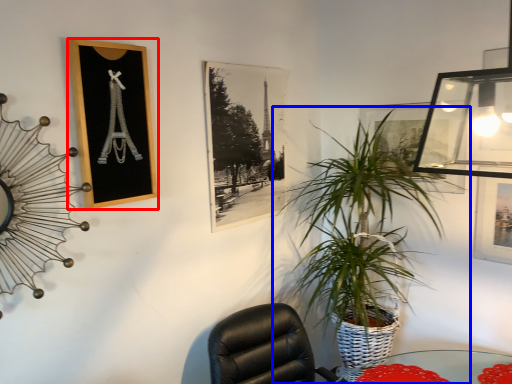
Question: Which object appears farthest to the camera in this image, picture frame (highlighted by a red box) or houseplant (highlighted by a blue box)?

Choices:
 (A) picture frame
 (B) houseplant

Answer: (B)